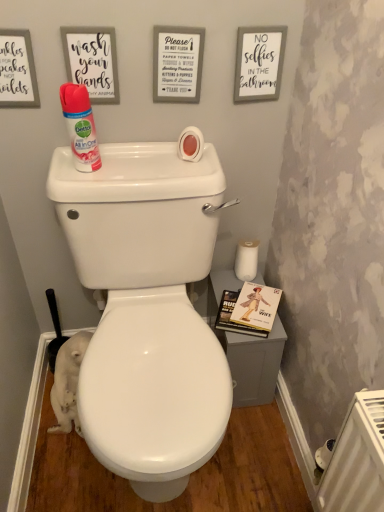
Locate an element on the screen. The height and width of the screenshot is (512, 384). white matte toilet paper at right is located at coordinates (246, 259).

Describe the element at coordinates (68, 383) in the screenshot. I see `white fur cat at lower left` at that location.

The width and height of the screenshot is (384, 512). What do you see at coordinates (17, 70) in the screenshot?
I see `white paper sign at upper left, the 4th copy positioned from the right` at bounding box center [17, 70].

Describe the element at coordinates (259, 63) in the screenshot. I see `white matte sign at upper right, the 4th copy positioned from the left` at that location.

At what (x,y) coordinates should I click in order to perform the action: click on white plastic radiator at lower right. Please return your answer as a coordinate pair (x, y). This screenshot has width=384, height=512. Looking at the image, I should click on (357, 459).

Identify the location of white glossy toilet at center. (147, 309).

Is point (119, 100) less distant than point (245, 87)?

Yes.

From a real-world perspective, is matte white sign at upper left, the 2th copy positioned from the left, positioned above or below white matte sign at upper right, the 4th copy positioned from the left?

Clearly, from a real-world perspective, matte white sign at upper left, the 2th copy positioned from the left, is above white matte sign at upper right, the 4th copy positioned from the left.

Which of these two, matte white sign at upper left, the 3th copy from the right, or white matte sign at upper right, the 4th copy positioned from the left, is smaller?

matte white sign at upper left, the 3th copy from the right, is smaller.

Between matte white sign at upper left, the 2th copy positioned from the left, and white matte sign at upper right, which is the first copy in right-to-left order, which one has less height?

matte white sign at upper left, the 2th copy positioned from the left, is shorter.

Is point (69, 84) closer or farther from the camera than point (64, 383)?

Point (69, 84) is positioned closer to the camera compared to point (64, 383).

Is matte pink spray can at upper left bigger or smaller than white fur cat at lower left?

In the image, matte pink spray can at upper left appears to be smaller than white fur cat at lower left.

Is matte pink spray can at upper left looking in the opposite direction of white fur cat at lower left?

That's not correct — matte pink spray can at upper left is not looking away from white fur cat at lower left.

Is matte pink spray can at upper left directly adjacent to white fur cat at lower left?

No, matte pink spray can at upper left is not beside white fur cat at lower left.

From a real-world perspective, is white paper sign at upper left, the 4th copy positioned from the right, below white matte toilet paper at right?

Actually, white paper sign at upper left, the 4th copy positioned from the right, is physically above white matte toilet paper at right in the real world.

Does white paper sign at upper left, the 4th copy positioned from the right, turn towards white matte toilet paper at right?

No, white paper sign at upper left, the 4th copy positioned from the right, is not oriented towards white matte toilet paper at right.

Considering the sizes of objects white paper sign at upper left, the 4th copy positioned from the right, and white matte toilet paper at right in the image provided, who is taller, white paper sign at upper left, the 4th copy positioned from the right, or white matte toilet paper at right?

white paper sign at upper left, the 4th copy positioned from the right, is taller.

From a real-world perspective, which object rests below the other?

From a 3D spatial view, white fur cat at lower left is below.

Would you consider white matte toilet paper at right to be distant from white fur cat at lower left?

They are positioned close to each other.

From the image's perspective, between white matte toilet paper at right and white fur cat at lower left, who is located below?

white fur cat at lower left.

Considering the sizes of objects white matte toilet paper at right and white fur cat at lower left in the image provided, who is bigger, white matte toilet paper at right or white fur cat at lower left?

Bigger between the two is white fur cat at lower left.

Is white matte sign at upper right, which is the first copy in right-to-left order, taller or shorter than white matte toilet paper at right?

Clearly, white matte sign at upper right, which is the first copy in right-to-left order, is taller compared to white matte toilet paper at right.

Does white matte sign at upper right, which is the first copy in right-to-left order, appear on the left side of white matte toilet paper at right?

Yes, white matte sign at upper right, which is the first copy in right-to-left order, is to the left of white matte toilet paper at right.

Are white matte sign at upper right, which is the first copy in right-to-left order, and white matte toilet paper at right making contact?

They are not placed beside each other.

Does white matte sign at upper right, which is the first copy in right-to-left order, come behind white matte toilet paper at right?

No.

Would you say white matte toilet paper at right is outside white paper sign at upper left, the 4th copy positioned from the right?

Yes, white matte toilet paper at right is located beyond the bounds of white paper sign at upper left, the 4th copy positioned from the right.

From the image's perspective, which one is positioned higher, white matte toilet paper at right or white paper sign at upper left, placed as the 1th copy when sorted from left to right?

white paper sign at upper left, placed as the 1th copy when sorted from left to right, is shown above in the image.

Considering the relative positions of white matte toilet paper at right and white paper sign at upper left, placed as the 1th copy when sorted from left to right, in the image provided, is white matte toilet paper at right to the right of white paper sign at upper left, placed as the 1th copy when sorted from left to right, from the viewer's perspective?

Yes, white matte toilet paper at right is to the right of white paper sign at upper left, placed as the 1th copy when sorted from left to right.

The image size is (384, 512). What are the coordinates of `the 4th copy in front of the white matte toilet paper at right, starting your count from the anchor` in the screenshot? It's located at (17, 70).

Is white glossy toilet at center at the left side of matte pink spray can at upper left?

In fact, white glossy toilet at center is to the right of matte pink spray can at upper left.

Is white glossy toilet at center taller than matte pink spray can at upper left?

Yes, white glossy toilet at center is taller than matte pink spray can at upper left.

From the image's perspective, is white glossy toilet at center on matte pink spray can at upper left?

No, from the image's perspective, white glossy toilet at center is not above matte pink spray can at upper left.

Considering the positions of objects white glossy toilet at center and matte pink spray can at upper left in the image provided, who is in front, white glossy toilet at center or matte pink spray can at upper left?

white glossy toilet at center is more forward.

Find the location of a particular element. The height and width of the screenshot is (512, 384). the 3rd copy located above the white matte sign at upper right, the 4th copy positioned from the left (from a real-world perspective) is located at coordinates (92, 61).

Image resolution: width=384 pixels, height=512 pixels. I want to click on animal that appears below the matte pink spray can at upper left (from the image's perspective), so click(68, 383).

Looking at the image, which one is located further to white fur cat at lower left, white glossy toilet at center or white matte toilet paper at right?

Among the two, white matte toilet paper at right is located further to white fur cat at lower left.

Estimate the real-world distances between objects in this image. Which object is further from hardcover book at right, white matte sign at upper right, the 4th copy positioned from the left, or white paper sign at upper left, placed as the 1th copy when sorted from left to right?

white paper sign at upper left, placed as the 1th copy when sorted from left to right, lies further to hardcover book at right than the other object.

Considering their positions, is matte white sign at upper left, the 3th copy from the right, positioned closer to white glossy toilet at center than white fur cat at lower left?

white fur cat at lower left lies closer to white glossy toilet at center than the other object.

Estimate the real-world distances between objects in this image. Which object is closer to matte white sign at upper left, the 2th copy positioned from the left, white paper sign at upper center, marked as the second copy in a right-to-left arrangement, or white fur cat at lower left?

Based on the image, white paper sign at upper center, marked as the second copy in a right-to-left arrangement, appears to be nearer to matte white sign at upper left, the 2th copy positioned from the left.

Based on their spatial positions, is white fur cat at lower left or hardcover book at right closer to white glossy toilet at center?

hardcover book at right is closer to white glossy toilet at center.

Consider the image. Estimate the real-world distances between objects in this image. Which object is further from white paper sign at upper left, placed as the 1th copy when sorted from left to right, white fur cat at lower left or hardcover book at right?

Based on the image, hardcover book at right appears to be further to white paper sign at upper left, placed as the 1th copy when sorted from left to right.

From the image, which object appears to be farther from white paper sign at upper left, placed as the 1th copy when sorted from left to right, white fur cat at lower left or matte white sign at upper left, the 3th copy from the right?

The object further to white paper sign at upper left, placed as the 1th copy when sorted from left to right, is white fur cat at lower left.

From the image, which object appears to be farther from hardcover book at right, white paper sign at upper center, the third copy viewed from the left, or white matte sign at upper right, which is the first copy in right-to-left order?

white paper sign at upper center, the third copy viewed from the left.

I want to click on magazine between white fur cat at lower left and white plastic radiator at lower right, so click(249, 310).

Identify the location of toilet paper between white fur cat at lower left and white plastic radiator at lower right. (246, 259).

At what (x,y) coordinates should I click in order to perform the action: click on cleaning product between matte white sign at upper left, the 3th copy from the right, and white plastic radiator at lower right, in the vertical direction. Please return your answer as a coordinate pair (x, y). The height and width of the screenshot is (512, 384). Looking at the image, I should click on (80, 126).

Identify the location of animal between white paper sign at upper center, marked as the second copy in a right-to-left arrangement, and white plastic radiator at lower right in the up-down direction. (68, 383).